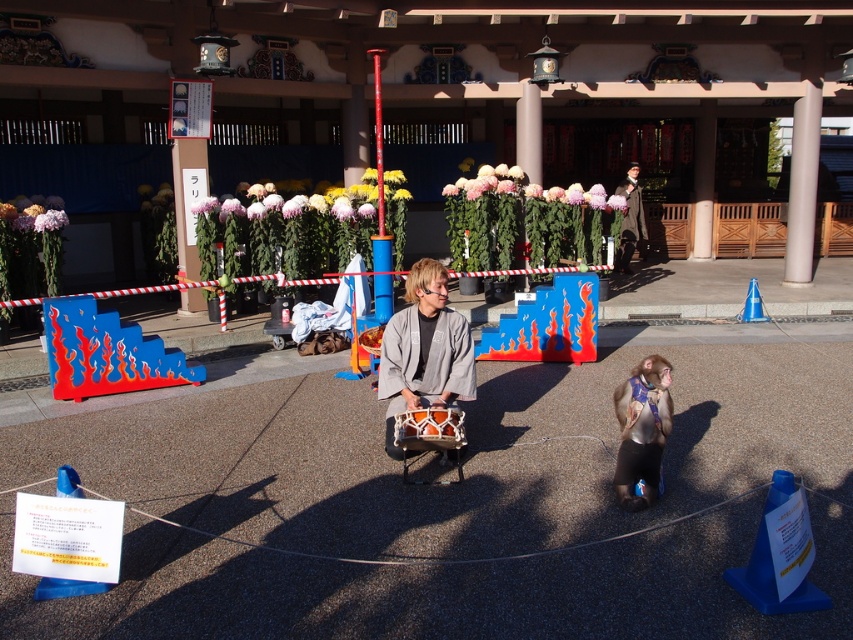
Who is higher up, metallic silver monkey at center or dark brown leather jacket at upper center?

dark brown leather jacket at upper center

Does point (663, 406) come farther from viewer compared to point (639, 212)?

No, it is in front of (639, 212).

This screenshot has width=853, height=640. In order to click on metallic silver monkey at center in this screenshot , I will do `click(642, 429)`.

Between gray fabric kimono at center and dark brown leather jacket at upper center, which one has more height?

With more height is dark brown leather jacket at upper center.

Can you confirm if gray fabric kimono at center is wider than dark brown leather jacket at upper center?

No, gray fabric kimono at center is not wider than dark brown leather jacket at upper center.

Between point (461, 314) and point (624, 248), which one is positioned behind?

The point (624, 248) is more distant.

The width and height of the screenshot is (853, 640). Identify the location of gray fabric kimono at center. (424, 349).

Which is above, gray fabric kimono at center or metallic silver monkey at center?

gray fabric kimono at center is higher up.

Between gray fabric kimono at center and metallic silver monkey at center, which one is positioned lower?

metallic silver monkey at center is lower down.

Which is behind, point (426, 330) or point (639, 448)?

Positioned behind is point (426, 330).

Identify the location of gray fabric kimono at center. (424, 349).